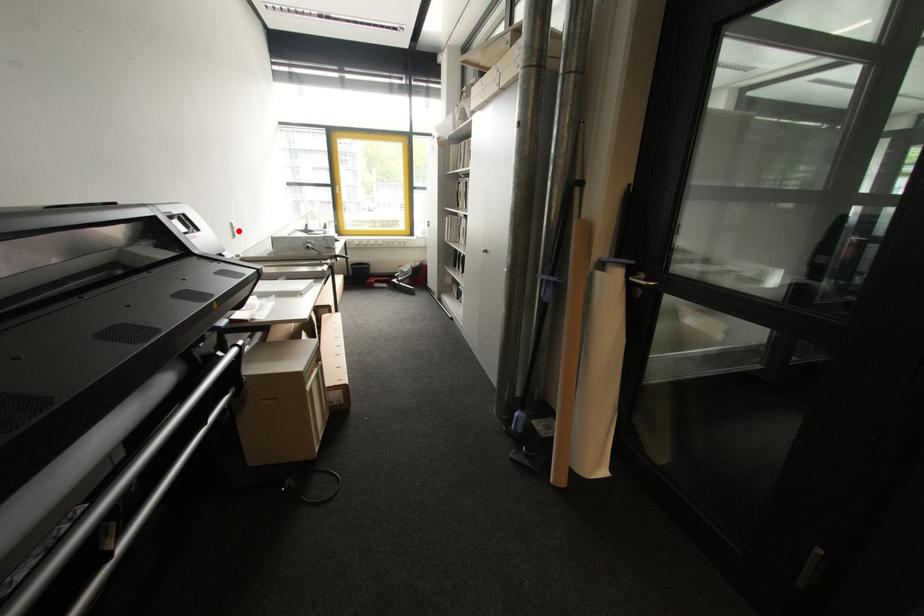
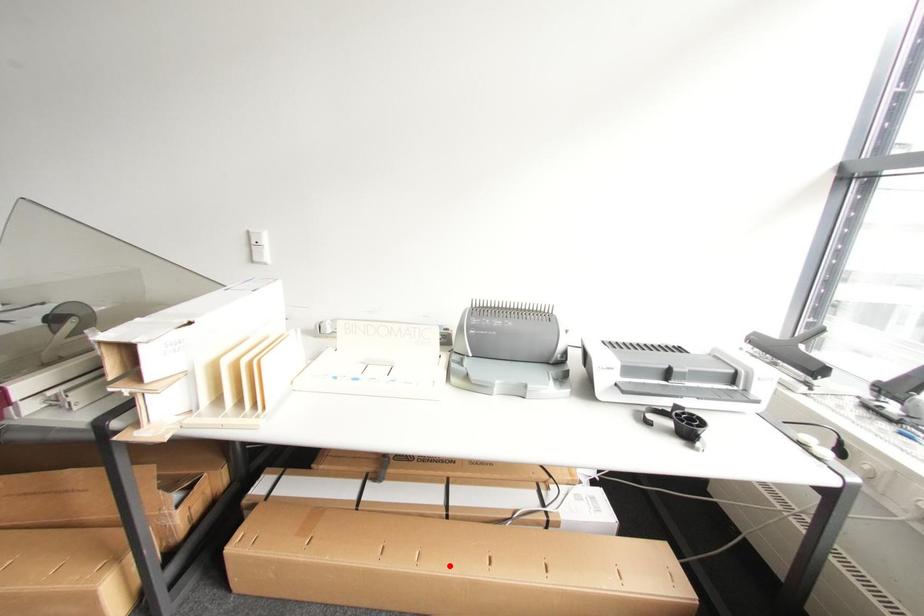
Looking at this image, I am providing you with two images of the same scene from different viewpoints. A red point is marked on the first image and another point is marked on the second image. Is the red point in image1 aligned with the point shown in image2?

No